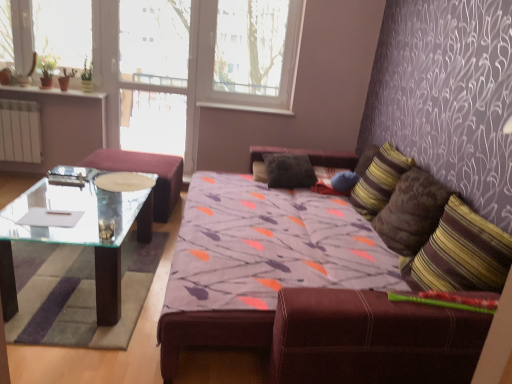
Question: Is white paper at left turned away from white plastic window frame at upper center?

Choices:
 (A) yes
 (B) no

Answer: (B)

Question: From the image's perspective, is white paper at left under white plastic window frame at upper center?

Choices:
 (A) no
 (B) yes

Answer: (B)

Question: Considering the relative positions of white paper at left and white plastic window frame at upper center in the image provided, is white paper at left to the right of white plastic window frame at upper center from the viewer's perspective?

Choices:
 (A) yes
 (B) no

Answer: (B)

Question: Does white paper at left have a lesser height compared to white plastic window frame at upper center?

Choices:
 (A) no
 (B) yes

Answer: (B)

Question: Considering the relative sizes of white paper at left and white plastic window frame at upper center in the image provided, is white paper at left smaller than white plastic window frame at upper center?

Choices:
 (A) no
 (B) yes

Answer: (B)

Question: Based on their positions, is transparent glass coffee table at left located to the left or right of brown textured pillow at right, acting as the 3th pillow starting from the back?

Choices:
 (A) left
 (B) right

Answer: (A)

Question: Is transparent glass coffee table at left spatially inside brown textured pillow at right, the first pillow positioned from the right, or outside of it?

Choices:
 (A) inside
 (B) outside

Answer: (B)

Question: Is transparent glass coffee table at left taller or shorter than brown textured pillow at right, marked as the first pillow in a front-to-back arrangement?

Choices:
 (A) tall
 (B) short

Answer: (B)

Question: From the image's perspective, is transparent glass coffee table at left located above or below brown textured pillow at right, marked as the first pillow in a front-to-back arrangement?

Choices:
 (A) above
 (B) below

Answer: (B)

Question: Based on their positions, is transparent glass table at left located to the left or right of transparent glass door at upper center?

Choices:
 (A) left
 (B) right

Answer: (A)

Question: Is transparent glass table at left bigger or smaller than transparent glass door at upper center?

Choices:
 (A) small
 (B) big

Answer: (B)

Question: Is transparent glass table at left inside or outside of transparent glass door at upper center?

Choices:
 (A) outside
 (B) inside

Answer: (A)

Question: Looking at their shapes, would you say transparent glass table at left is wider or thinner than transparent glass door at upper center?

Choices:
 (A) wide
 (B) thin

Answer: (A)

Question: Relative to transparent glass coffee table at left, is striped fabric pillow at right, the second pillow when ordered from front to back, in front or behind?

Choices:
 (A) front
 (B) behind

Answer: (B)

Question: In terms of height, does striped fabric pillow at right, the second pillow when ordered from front to back, look taller or shorter compared to transparent glass coffee table at left?

Choices:
 (A) short
 (B) tall

Answer: (B)